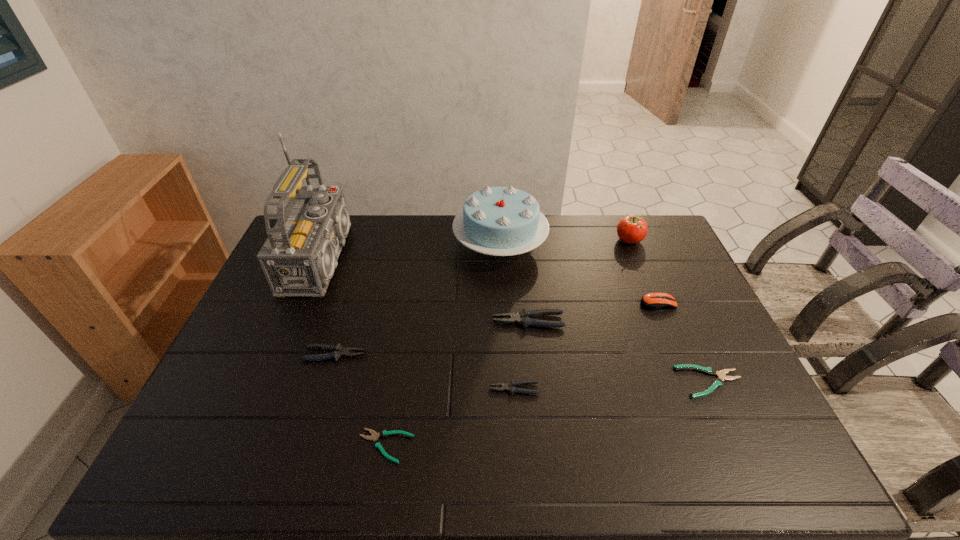
The width and height of the screenshot is (960, 540). What are the coordinates of `free location that satisfies the following two spatial constraints: 1. on the back side of the birthday cake; 2. on the right side of the tomato` in the screenshot? It's located at (500, 240).

This screenshot has width=960, height=540. In order to click on vacant space that satisfies the following two spatial constraints: 1. on the back side of the shortest object; 2. at the gripping part of the second farthest pliers in this screenshot , I will do `click(400, 354)`.

This screenshot has width=960, height=540. What are the coordinates of `vacant space that satisfies the following two spatial constraints: 1. on the front side of the second tallest object; 2. at the gripping part of the fourth nearest object` in the screenshot? It's located at (506, 354).

The height and width of the screenshot is (540, 960). What are the coordinates of `vacant space that satisfies the following two spatial constraints: 1. on the front side of the bigger teal pliers; 2. at the gripping part of the nearest gray pliers` in the screenshot? It's located at (713, 389).

What are the coordinates of `vacant region that satisfies the following two spatial constraints: 1. on the front side of the eighth shortest object; 2. on the front-facing side of the gray radio receiver` in the screenshot? It's located at (501, 259).